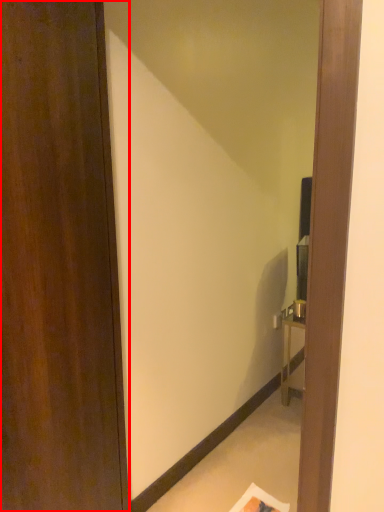
Question: Considering the relative positions of door (annotated by the red box) and mirror in the image provided, where is door (annotated by the red box) located with respect to the staircase?

Choices:
 (A) right
 (B) left

Answer: (B)